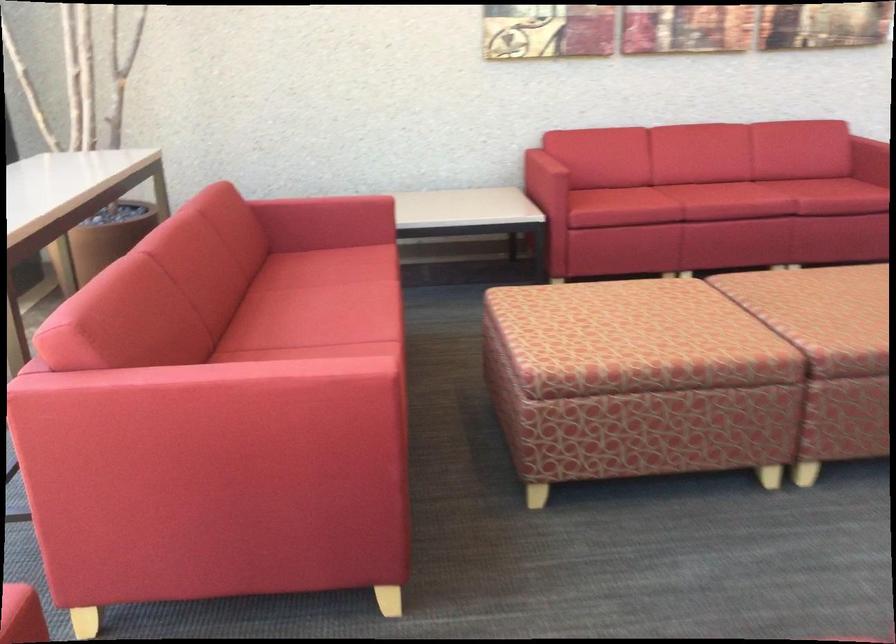
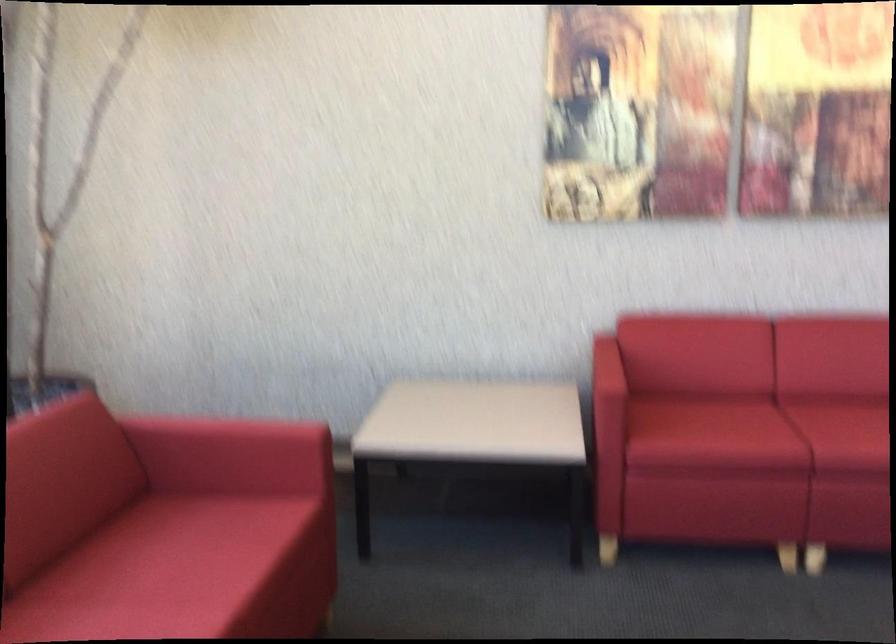
Locate, in the second image, the point that corresponds to (x=340, y=263) in the first image.

(195, 547)